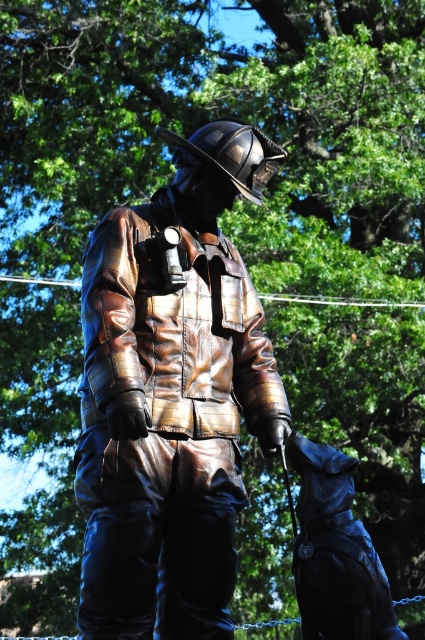
From the picture: You are a tour guide explaining the statue to visitors. You need to mention both the shiny bronze firefighter at center and the shiny black dog at lower right. How far apart are they?

The shiny bronze firefighter at center and the shiny black dog at lower right are 67.39 centimeters apart from each other.

You are a visitor at the park and want to take a photo of the shiny bronze firefighter at center and the shiny black dog at lower right. Which one should you zoom in on to capture more details of its face?

The shiny bronze firefighter at center is taller than the shiny black dog at lower right, so you should zoom in on the shiny bronze firefighter at center to capture more details of its face.

You are standing in a park and see the bronze statue of a firefighter. The statue is located at the point with coordinates [172,396]. If you want to take a photo of the statue from the front, where should you position yourself relative to the statue?

The point [172,396] indicates the shiny bronze firefighter at center. To take a photo from the front, you should position yourself directly in front of the statue at the center point.